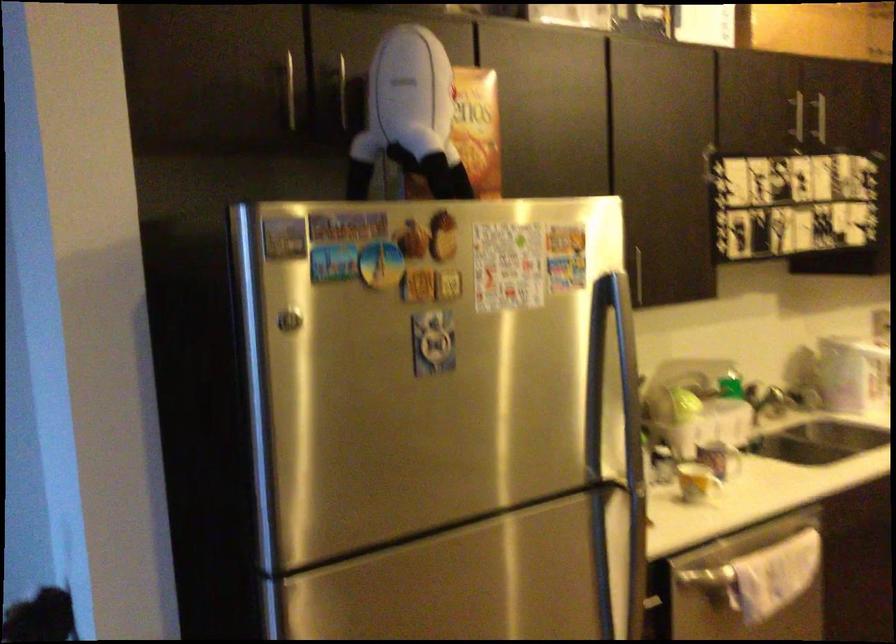
You are a GUI agent. You are given a task and a screenshot of the screen. Output one action in this format:
    pyautogui.click(x=<x>, y=<y>)
    Task: Click on the refrigerator door handle
    The width and height of the screenshot is (896, 644).
    Given the screenshot: What is the action you would take?
    pyautogui.click(x=615, y=451)